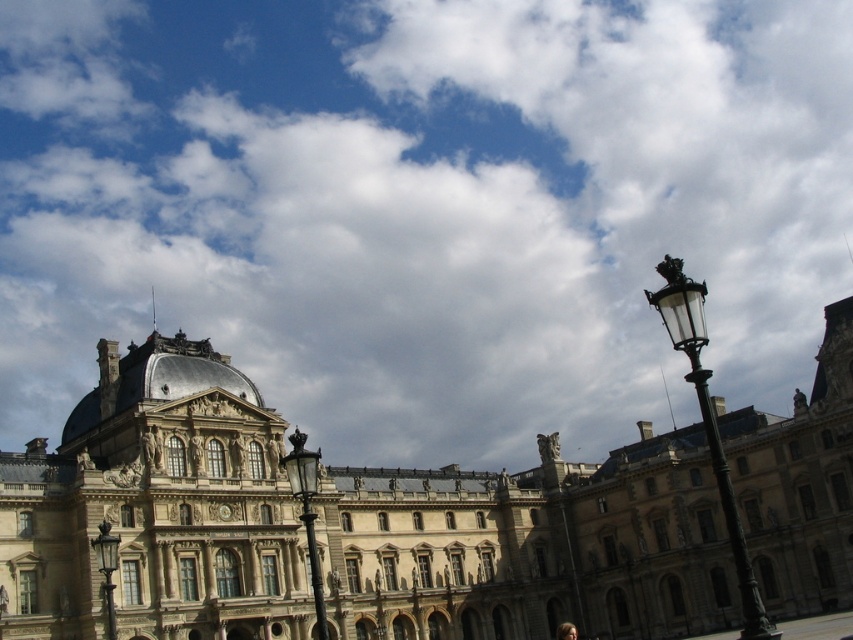
You are an architect analyzing the image of a grand building. You notice the cloudy sky at upper center and the golden stone palace at center. Which of these two elements occupies a larger portion of the image?

The cloudy sky at upper center is bigger than the golden stone palace at center, so it occupies a larger portion of the image.

You are standing in front of the grand building and notice two points marked in the image. The first point is at coordinates point [50,204] and the second is at point [845,605]. Which of these points is closer to the viewer?

Point [845,605] is closer to the viewer because it is in front of point [50,204].